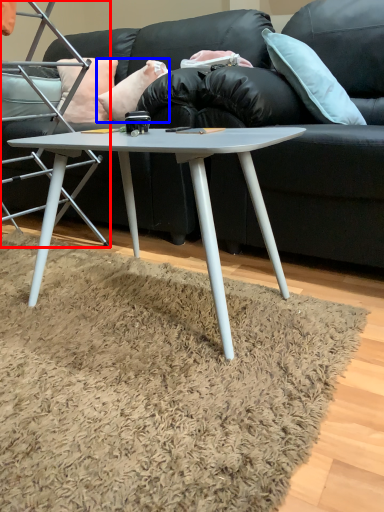
Question: Which point is closer to the camera, chair (highlighted by a red box) or pillow (highlighted by a blue box)?

Choices:
 (A) chair
 (B) pillow

Answer: (A)